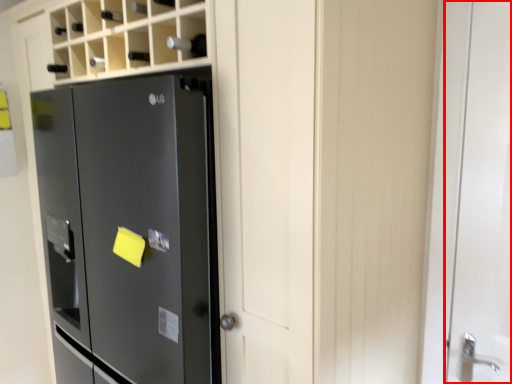
Question: In this image, where is door (annotated by the red box) located relative to refrigerator?

Choices:
 (A) left
 (B) right

Answer: (B)